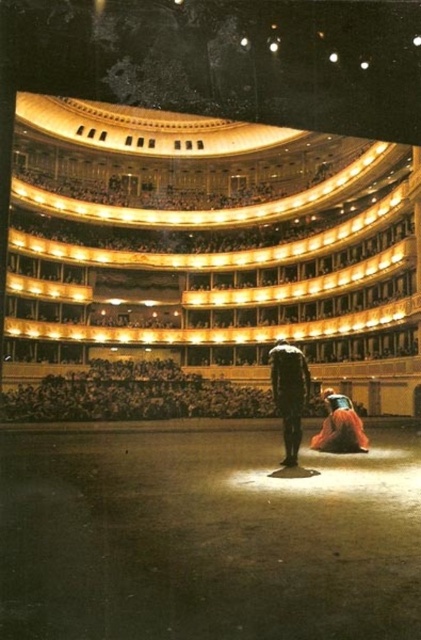
The image size is (421, 640). Describe the element at coordinates (290, 394) in the screenshot. I see `black matte suit at center` at that location.

Between black matte suit at center and velvet orange dress at lower right, which one has less height?

velvet orange dress at lower right is shorter.

Is point (298, 385) positioned behind point (322, 422)?

No, (298, 385) is in front of (322, 422).

Identify the location of black matte suit at center. (290, 394).